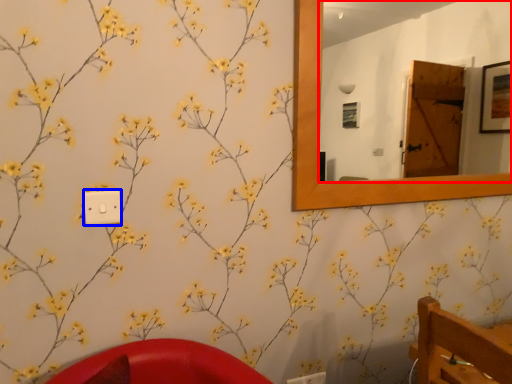
Question: Among these objects, which one is farthest to the camera, mirror (highlighted by a red box) or light switch (highlighted by a blue box)?

Choices:
 (A) mirror
 (B) light switch

Answer: (A)